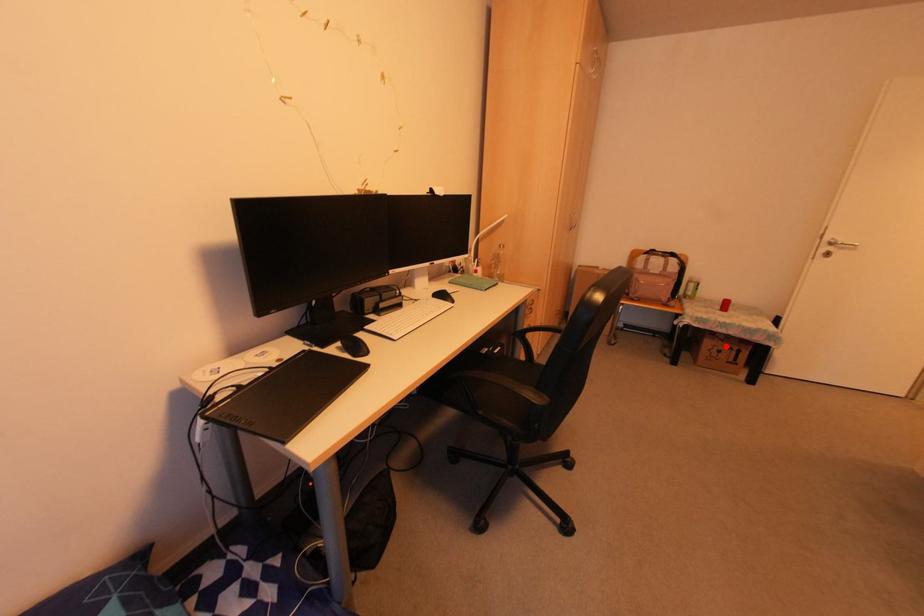
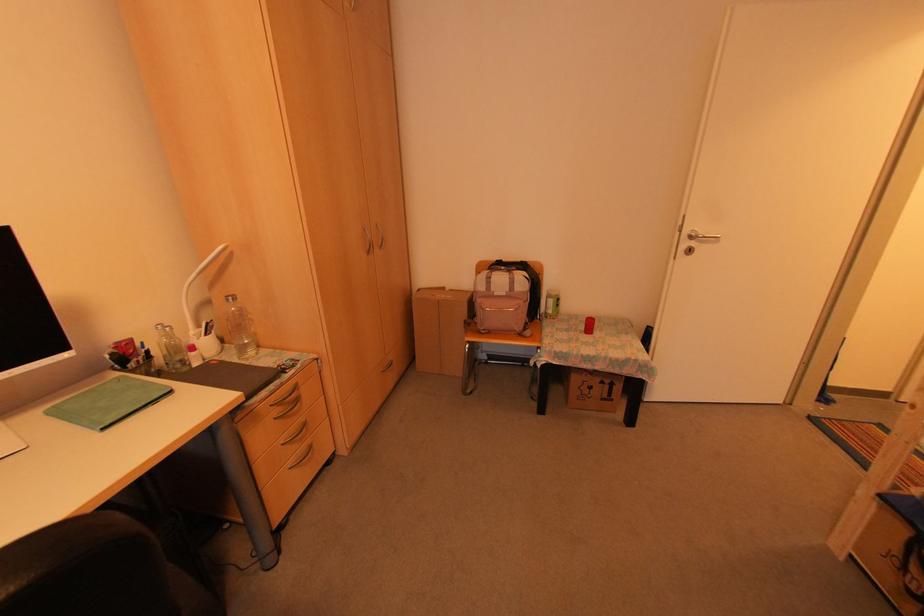
In the second image, find the point that corresponds to the highlighted location in the first image.

(598, 381)